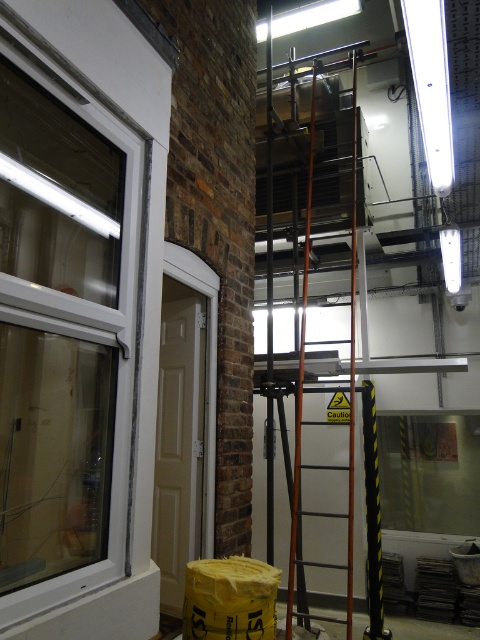
Based on the photo, you are a painter who needs to move a ladder to the window to clean it. The transparent glass window at left and the metallic orange ladder at center are in your view. Which object is smaller in size so that the ladder can fit through the window area?

The transparent glass window at left is smaller in size compared to the metallic orange ladder at center, so the ladder may not fit through the window area unless adjusted.

You are a painter who needs to move a 1.2 meter wide painting to the transparent glass window at left. The metallic orange ladder at center is in the way. Can you move the ladder to the side to make space for the painting?

The transparent glass window at left is narrower than the metallic orange ladder at center, so moving the ladder might not be necessary since the window is already smaller. However, since the ladder is blocking access, you should move it aside to create enough space for the painting.